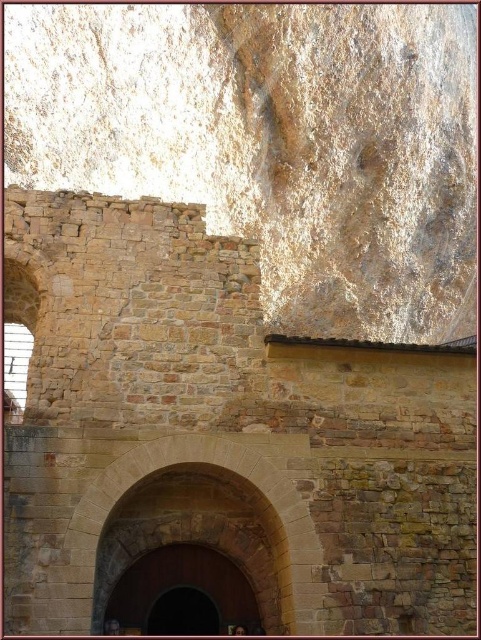
Question: Among these points, which one is farthest from the camera?

Choices:
 (A) (138, 621)
 (B) (316, 593)

Answer: (A)

Question: Does smooth stone archway at center have a larger size compared to brown wooden door at center?

Choices:
 (A) yes
 (B) no

Answer: (A)

Question: Which object appears closest to the camera in this image?

Choices:
 (A) smooth stone archway at center
 (B) brown wooden door at center

Answer: (A)

Question: Which point is farther from the camera taking this photo?

Choices:
 (A) (301, 497)
 (B) (238, 595)

Answer: (B)

Question: Does smooth stone archway at center come behind brown wooden door at center?

Choices:
 (A) yes
 (B) no

Answer: (B)

Question: Can you confirm if smooth stone archway at center is positioned above brown wooden door at center?

Choices:
 (A) no
 (B) yes

Answer: (B)